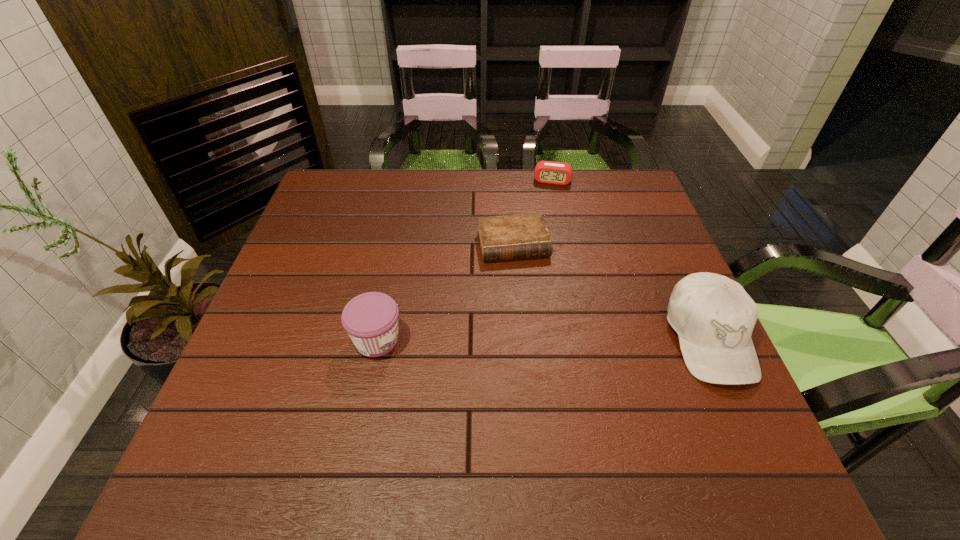
Where is `the leftmost object`? Image resolution: width=960 pixels, height=540 pixels. the leftmost object is located at coordinates (371, 319).

At what (x,y) coordinates should I click in order to perform the action: click on jam. Please return your answer as a coordinate pair (x, y). Looking at the image, I should click on (371, 319).

This screenshot has width=960, height=540. I want to click on the tallest object, so click(714, 317).

Find the location of a particular element. baseball cap is located at coordinates (714, 317).

The width and height of the screenshot is (960, 540). Find the location of `alarm clock`. alarm clock is located at coordinates (549, 172).

Identify the location of the third tallest object. The width and height of the screenshot is (960, 540). (549, 172).

At what (x,y) coordinates should I click in order to perform the action: click on the shortest object. Please return your answer as a coordinate pair (x, y). Looking at the image, I should click on (518, 236).

This screenshot has width=960, height=540. I want to click on the third nearest object, so click(518, 236).

At what (x,y) coordinates should I click in order to perform the action: click on free space located 0.200m on the front label of the third shortest object. Please return your answer as a coordinate pair (x, y). Looking at the image, I should click on (495, 340).

The width and height of the screenshot is (960, 540). Find the location of `blank space located on the front-facing side of the baseball cap`. blank space located on the front-facing side of the baseball cap is located at coordinates (750, 429).